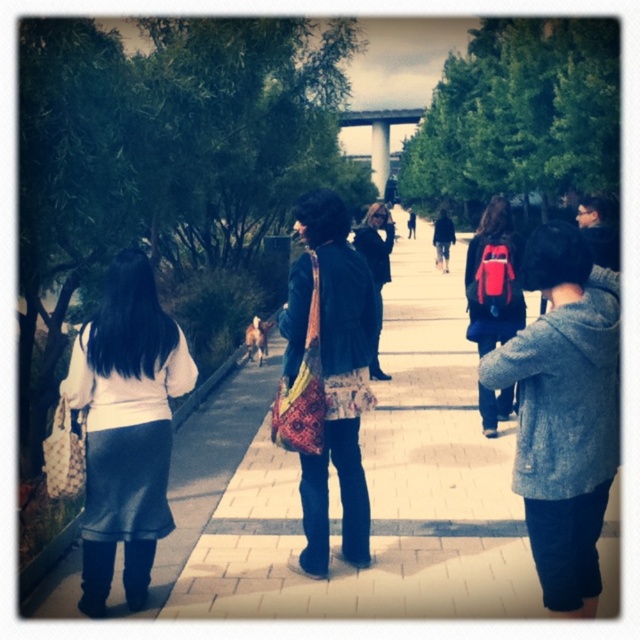
Question: Can you confirm if patterned fabric bag at center is bigger than white concrete pillar at center?

Choices:
 (A) no
 (B) yes

Answer: (B)

Question: Estimate the real-world distances between objects in this image. Which object is closer to the brick pavement at center?

Choices:
 (A) matte white sweater at left
 (B) patterned fabric bag at center

Answer: (B)

Question: Estimate the real-world distances between objects in this image. Which object is closer to the matte red backpack at center-right?

Choices:
 (A) matte white sweater at left
 (B) brick pavement at center
 (C) white concrete pillar at center
 (D) patterned fabric bag at center

Answer: (D)

Question: Which point is closer to the camera taking this photo?

Choices:
 (A) (x=358, y=227)
 (B) (x=380, y=136)
 (C) (x=410, y=529)

Answer: (C)

Question: In this image, where is matte white sweater at left located relative to white concrete pillar at center?

Choices:
 (A) above
 (B) below

Answer: (B)

Question: In this image, where is brick pavement at center located relative to matte white sweater at left?

Choices:
 (A) right
 (B) left

Answer: (A)